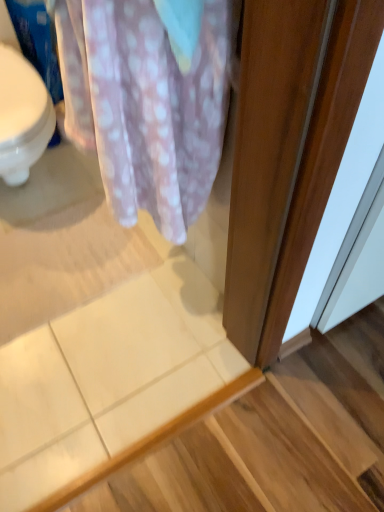
Question: Considering the relative sizes of white tile at lower left and pink polka dot fabric at upper left in the image provided, is white tile at lower left taller than pink polka dot fabric at upper left?

Choices:
 (A) yes
 (B) no

Answer: (B)

Question: Would you say white tile at lower left is a long distance from pink polka dot fabric at upper left?

Choices:
 (A) yes
 (B) no

Answer: (B)

Question: Is white tile at lower left to the right of pink polka dot fabric at upper left from the viewer's perspective?

Choices:
 (A) no
 (B) yes

Answer: (B)

Question: From the image's perspective, does white tile at lower left appear higher than pink polka dot fabric at upper left?

Choices:
 (A) no
 (B) yes

Answer: (A)

Question: Is white tile at lower left touching pink polka dot fabric at upper left?

Choices:
 (A) no
 (B) yes

Answer: (A)

Question: From a real-world perspective, is white tile at lower left positioned under pink polka dot fabric at upper left based on gravity?

Choices:
 (A) yes
 (B) no

Answer: (A)

Question: Does pink polka dot fabric at upper left have a lesser height compared to white tile at lower left?

Choices:
 (A) yes
 (B) no

Answer: (B)

Question: Does pink polka dot fabric at upper left have a greater height compared to white tile at lower left?

Choices:
 (A) yes
 (B) no

Answer: (A)

Question: From the image's perspective, is pink polka dot fabric at upper left under white tile at lower left?

Choices:
 (A) yes
 (B) no

Answer: (B)

Question: Is pink polka dot fabric at upper left thinner than white tile at lower left?

Choices:
 (A) no
 (B) yes

Answer: (B)

Question: Could you tell me if pink polka dot fabric at upper left is turned towards white tile at lower left?

Choices:
 (A) yes
 (B) no

Answer: (B)

Question: Considering the relative positions of pink polka dot fabric at upper left and white tile at lower left in the image provided, is pink polka dot fabric at upper left to the right of white tile at lower left from the viewer's perspective?

Choices:
 (A) no
 (B) yes

Answer: (A)

Question: From the image's perspective, is white tile at lower left positioned above or below pink polka dot fabric at upper left?

Choices:
 (A) above
 (B) below

Answer: (B)